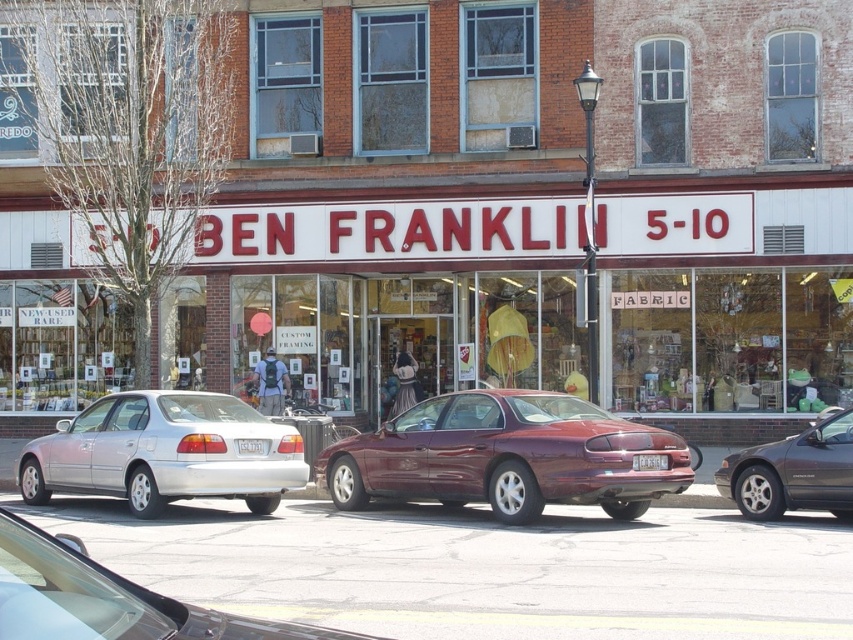
You are driving a car that is 5 meters long. You want to park your car between the maroon metallic sedan at center and the silver metallic sedan at center. Is there enough space between them to park your car?

The distance between the maroon metallic sedan at center and the silver metallic sedan at center is 8.85 meters. Since your car is 5 meters long, there is sufficient space to park between them.

Based on the photo, you are a delivery driver who needs to park your 12 foot long truck in front of Ben Franklin 5 10 store. The parking space between the maroon metallic sedan at center and the silver metallic sedan at center is available. Can your truck fit in that space?

The maroon metallic sedan at center is larger in size than the silver metallic sedan at center, but the exact distance between them isn generated. Without knowing the actual space between the two sedans, it is impossible to determine if the 12 foot long truck can fit.

You are a delivery driver who needs to park your truck between the silver metallic sedan at left and the metallic gray sedan at right. The truck requires 6 meters of space to park. Is there enough space between them to park your truck?

The distance between the silver metallic sedan at left and the metallic gray sedan at right is 6.36 meters, which is more than the required 6 meters. Therefore, there is enough space to park the truck between them.